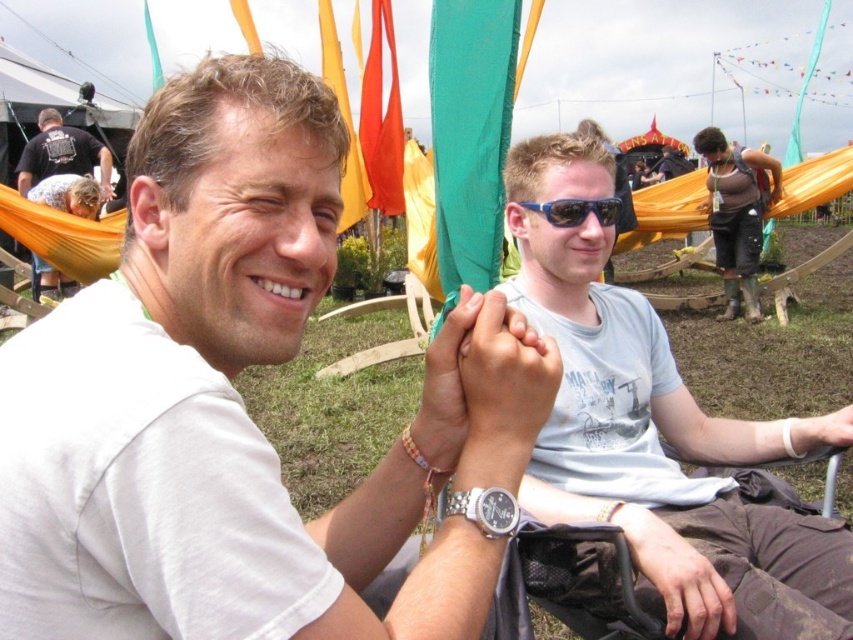
Can you confirm if white matte t-shirt at center is wider than black t-shirt at upper left?

No, white matte t-shirt at center is not wider than black t-shirt at upper left.

Is point (45, 497) positioned in front of point (45, 115)?

Yes, it is.

Identify the location of white matte t-shirt at center. The image size is (853, 640). (242, 406).

Looking at this image, is white matte t-shirt at center to the left of light blue cotton t-shirt at center from the viewer's perspective?

Indeed, white matte t-shirt at center is positioned on the left side of light blue cotton t-shirt at center.

Consider the image. Can you confirm if white matte t-shirt at center is bigger than light blue cotton t-shirt at center?

Incorrect, white matte t-shirt at center is not larger than light blue cotton t-shirt at center.

Is point (422, 396) closer to camera compared to point (724, 576)?

Yes, it is in front of point (724, 576).

Where is `white matte t-shirt at center`? white matte t-shirt at center is located at coordinates (242, 406).

Is point (757, 461) farther from camera compared to point (24, 193)?

No, (757, 461) is in front of (24, 193).

Between point (616, 456) and point (49, 152), which one is positioned behind?

Point (49, 152)

Is point (621, 320) positioned in front of point (62, 150)?

Yes, point (621, 320) is in front of point (62, 150).

The width and height of the screenshot is (853, 640). What are the coordinates of `light blue cotton t-shirt at center` in the screenshot? It's located at (659, 433).